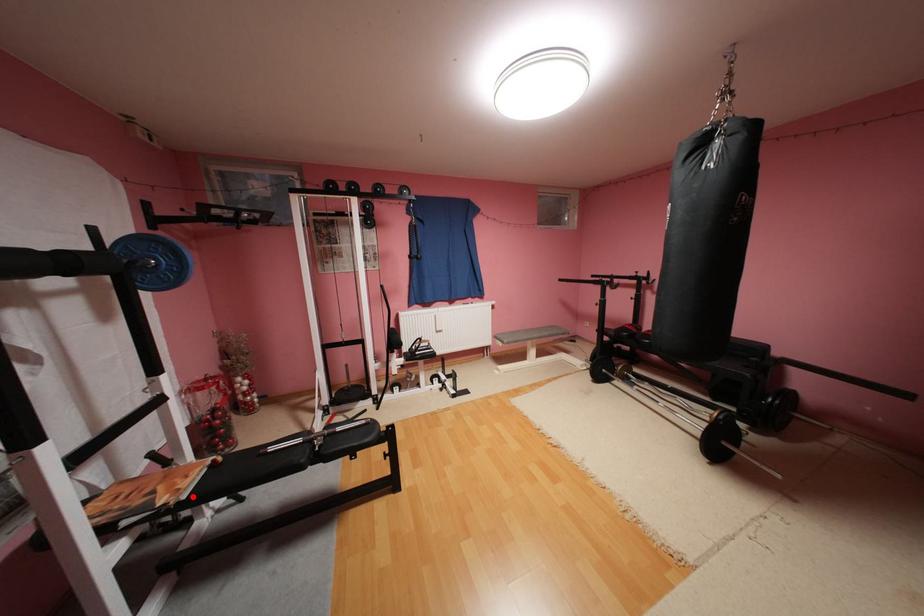
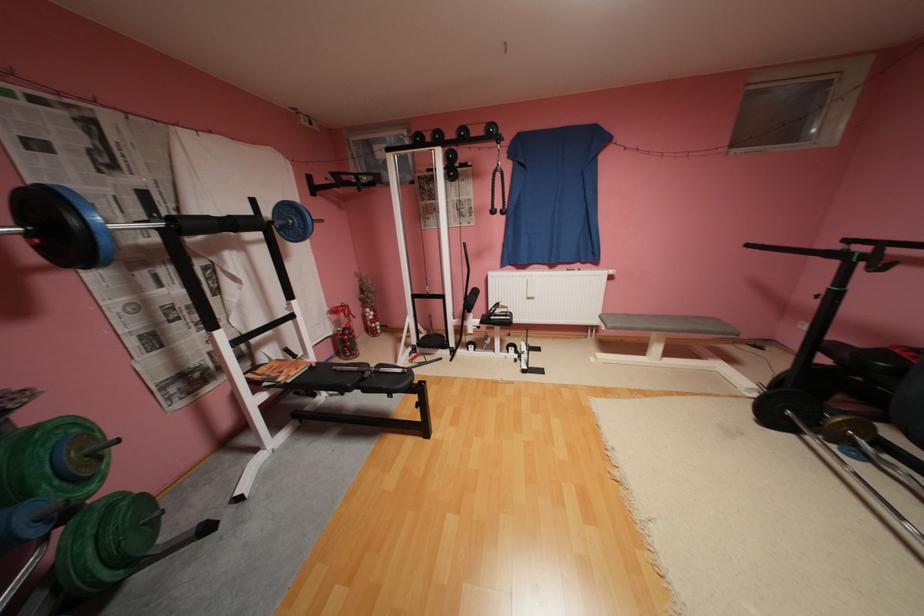
Question: I am providing you with two images of the same scene from different viewpoints. A red point is shown in image1. For the corresponding object point in image2, is it positioned nearer or farther from the camera?

Choices:
 (A) Nearer
 (B) Farther

Answer: (A)